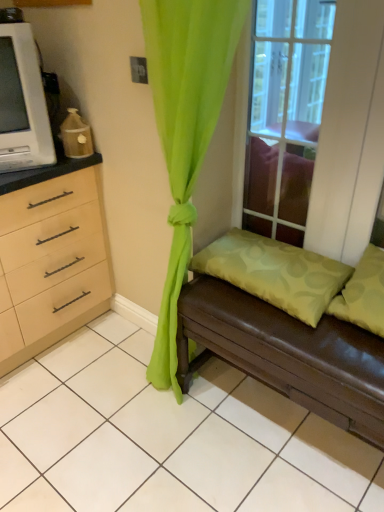
Locate an element on the screen. This screenshot has width=384, height=512. brown leather studio couch at lower right is located at coordinates (286, 353).

Where is `green sheer curtain at center`? The width and height of the screenshot is (384, 512). green sheer curtain at center is located at coordinates (185, 130).

At what (x,y) coordinates should I click in order to perform the action: click on clear glass window at upper center. Please return your answer as a coordinate pair (x, y). Looking at the image, I should click on (285, 113).

Locate an element on the screen. The width and height of the screenshot is (384, 512). green fabric pillow at lower right, the 2th pillow when ordered from right to left is located at coordinates (275, 272).

Is clear glass window at upper center aimed at green sheer curtain at center?

Yes, clear glass window at upper center is oriented towards green sheer curtain at center.

Which of these two, clear glass window at upper center or green sheer curtain at center, is bigger?

green sheer curtain at center is bigger.

Is clear glass window at upper center spatially inside green sheer curtain at center, or outside of it?

clear glass window at upper center is spatially situated outside green sheer curtain at center.

Is there a large distance between clear glass window at upper center and green sheer curtain at center?

They are positioned close to each other.

Can you see green fabric pillow at right, the second pillow when ordered from left to right, touching white plastic microwave at left?

No, green fabric pillow at right, the second pillow when ordered from left to right, is not next to white plastic microwave at left.

Locate an element on the screen. This screenshot has height=512, width=384. open lying on the left of green fabric pillow at right, which is the first pillow in right-to-left order is located at coordinates [22, 103].

Is green fabric pillow at right, which is the first pillow in right-to-left order, looking in the opposite direction of white plastic microwave at left?

That's not correct — green fabric pillow at right, which is the first pillow in right-to-left order, is not looking away from white plastic microwave at left.

Which object is positioned more to the right, green fabric pillow at right, the second pillow when ordered from left to right, or white plastic microwave at left?

From the viewer's perspective, green fabric pillow at right, the second pillow when ordered from left to right, appears more on the right side.

Considering the positions of point (267, 245) and point (338, 360), is point (267, 245) closer or farther from the camera than point (338, 360)?

Point (267, 245) is farther from the camera than point (338, 360).

Can you confirm if green fabric pillow at lower right, the 2th pillow when ordered from right to left, is wider than brown leather studio couch at lower right?

In fact, green fabric pillow at lower right, the 2th pillow when ordered from right to left, might be narrower than brown leather studio couch at lower right.

Is green fabric pillow at lower right, the 2th pillow when ordered from right to left, directly adjacent to brown leather studio couch at lower right?

There is a gap between green fabric pillow at lower right, the 2th pillow when ordered from right to left, and brown leather studio couch at lower right.

From the picture: Is brown leather studio couch at lower right surrounded by green fabric pillow at lower right, the 2th pillow when ordered from right to left?

Definitely not — brown leather studio couch at lower right is not inside green fabric pillow at lower right, the 2th pillow when ordered from right to left.

Which object is further away from the camera, green fabric pillow at right, which is the first pillow in right-to-left order, or green fabric pillow at lower right, which is the 1th pillow from left to right?

green fabric pillow at lower right, which is the 1th pillow from left to right, is further from the camera.

Does point (373, 302) lie behind point (286, 262)?

No, (373, 302) is closer to viewer.

Which object is positioned more to the right, green fabric pillow at right, the second pillow when ordered from left to right, or green fabric pillow at lower right, the 2th pillow when ordered from right to left?

From the viewer's perspective, green fabric pillow at right, the second pillow when ordered from left to right, appears more on the right side.

Is green fabric pillow at right, which is the first pillow in right-to-left order, aimed at green fabric pillow at lower right, which is the 1th pillow from left to right?

No, green fabric pillow at right, which is the first pillow in right-to-left order, is not aimed at green fabric pillow at lower right, which is the 1th pillow from left to right.

What's the angular difference between green fabric pillow at lower right, the 2th pillow when ordered from right to left, and green fabric pillow at right, the second pillow when ordered from left to right,'s facing directions?

The angular difference between green fabric pillow at lower right, the 2th pillow when ordered from right to left, and green fabric pillow at right, the second pillow when ordered from left to right, is 1.49 degrees.

Is green fabric pillow at lower right, the 2th pillow when ordered from right to left, spatially inside green fabric pillow at right, which is the first pillow in right-to-left order, or outside of it?

green fabric pillow at lower right, the 2th pillow when ordered from right to left, is outside green fabric pillow at right, which is the first pillow in right-to-left order.

You are a GUI agent. You are given a task and a screenshot of the screen. Output one action in this format:
    pyautogui.click(x=<x>, y=<y>)
    Task: Click on the pillow located below the green fabric pillow at lower right, the 2th pillow when ordered from right to left (from the image's perspective)
    The image size is (384, 512).
    Given the screenshot: What is the action you would take?
    pyautogui.click(x=363, y=294)

From the image's perspective, is green fabric pillow at lower right, which is the 1th pillow from left to right, above or below green fabric pillow at right, the second pillow when ordered from left to right?

green fabric pillow at lower right, which is the 1th pillow from left to right, is situated higher than green fabric pillow at right, the second pillow when ordered from left to right, in the image.

Does point (282, 200) appear closer or farther from the camera than point (314, 281)?

Clearly, point (282, 200) is more distant from the camera than point (314, 281).

Consider the image. In terms of width, does clear glass window at upper center look wider or thinner when compared to green fabric pillow at lower right, which is the 1th pillow from left to right?

clear glass window at upper center is thinner than green fabric pillow at lower right, which is the 1th pillow from left to right.

From a real-world perspective, which object stands above the other?

clear glass window at upper center.

From the picture: Is brown leather studio couch at lower right facing away from green fabric pillow at lower right, the 2th pillow when ordered from right to left?

That's not correct — brown leather studio couch at lower right is not looking away from green fabric pillow at lower right, the 2th pillow when ordered from right to left.

Is brown leather studio couch at lower right not within green fabric pillow at lower right, the 2th pillow when ordered from right to left?

brown leather studio couch at lower right lies outside green fabric pillow at lower right, the 2th pillow when ordered from right to left,'s area.

From a real-world perspective, is brown leather studio couch at lower right positioned under green fabric pillow at lower right, which is the 1th pillow from left to right, based on gravity?

Indeed, from a real-world perspective, brown leather studio couch at lower right is positioned beneath green fabric pillow at lower right, which is the 1th pillow from left to right.

From the image's perspective, which pillow is the 2nd one above the brown leather studio couch at lower right? Please provide its 2D coordinates.

[(275, 272)]

I want to click on window above the green sheer curtain at center (from the image's perspective), so click(x=285, y=113).

From the white plastic microwave at left, count 2nd pillow to the right and point to it. Please provide its 2D coordinates.

[(363, 294)]

From the image, which object appears to be nearer to green fabric pillow at right, the second pillow when ordered from left to right, clear glass window at upper center or green sheer curtain at center?

Based on the image, clear glass window at upper center appears to be nearer to green fabric pillow at right, the second pillow when ordered from left to right.

In the scene shown: Estimate the real-world distances between objects in this image. Which object is further from green fabric pillow at lower right, which is the 1th pillow from left to right, green fabric pillow at right, the second pillow when ordered from left to right, or clear glass window at upper center?

The object further to green fabric pillow at lower right, which is the 1th pillow from left to right, is clear glass window at upper center.

When comparing their distances from green fabric pillow at right, which is the first pillow in right-to-left order, does clear glass window at upper center or white plastic microwave at left seem closer?

clear glass window at upper center is positioned closer to the anchor green fabric pillow at right, which is the first pillow in right-to-left order.

Which object lies further to the anchor point green fabric pillow at lower right, the 2th pillow when ordered from right to left, green sheer curtain at center or green fabric pillow at right, which is the first pillow in right-to-left order?

green sheer curtain at center.

In the scene shown: Based on their spatial positions, is green fabric pillow at right, which is the first pillow in right-to-left order, or green sheer curtain at center further from white plastic microwave at left?

green fabric pillow at right, which is the first pillow in right-to-left order, is further to white plastic microwave at left.

When comparing their distances from white plastic microwave at left, does brown leather studio couch at lower right or green fabric pillow at right, the second pillow when ordered from left to right, seem closer?

Among the two, brown leather studio couch at lower right is located nearer to white plastic microwave at left.

When comparing their distances from clear glass window at upper center, does green fabric pillow at lower right, the 2th pillow when ordered from right to left, or green fabric pillow at right, the second pillow when ordered from left to right, seem further?

green fabric pillow at right, the second pillow when ordered from left to right, lies further to clear glass window at upper center than the other object.

Considering their positions, is brown leather studio couch at lower right positioned further to white plastic microwave at left than clear glass window at upper center?

Based on the image, brown leather studio couch at lower right appears to be further to white plastic microwave at left.

Locate an element on the screen. The image size is (384, 512). curtain between clear glass window at upper center and brown leather studio couch at lower right in the up-down direction is located at coordinates (185, 130).

Find the location of `pillow between green fabric pillow at lower right, the 2th pillow when ordered from right to left, and brown leather studio couch at lower right in the up-down direction`. pillow between green fabric pillow at lower right, the 2th pillow when ordered from right to left, and brown leather studio couch at lower right in the up-down direction is located at coordinates (363, 294).

Find the location of a particular element. curtain between white plastic microwave at left and green fabric pillow at right, the second pillow when ordered from left to right, in the horizontal direction is located at coordinates (185, 130).

At what (x,y) coordinates should I click in order to perform the action: click on studio couch between green sheer curtain at center and green fabric pillow at right, the second pillow when ordered from left to right, in the horizontal direction. Please return your answer as a coordinate pair (x, y). Looking at the image, I should click on (286, 353).